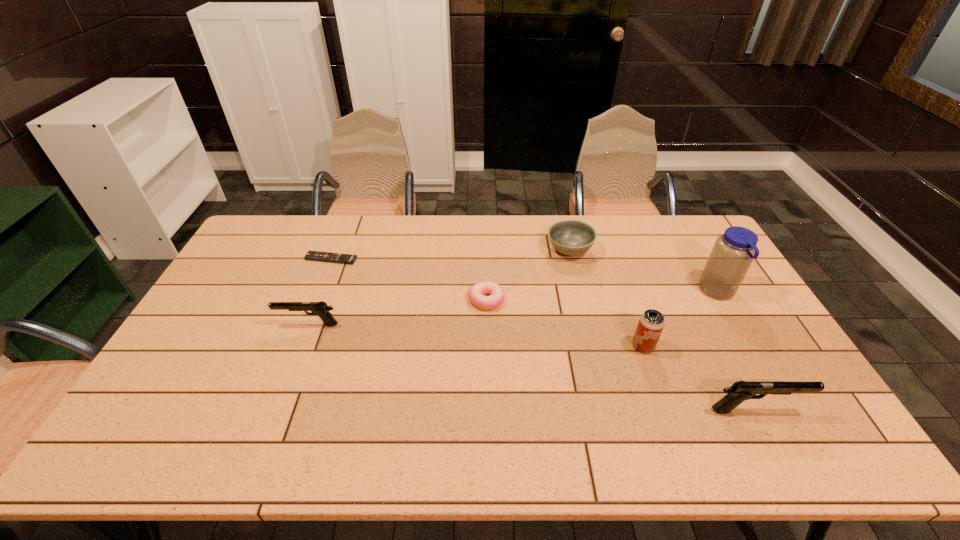
To ensure equal spacing by inserting another gun among them, please point out a vacant spot for this new gun. Please provide its 2D coordinates. Your answer should be formatted as a tuple, i.e. [(x, y)], where the tuple contains the x and y coordinates of a point satisfying the conditions above.

[(513, 363)]